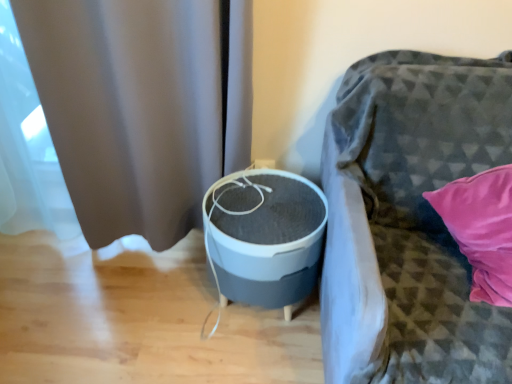
This screenshot has width=512, height=384. Describe the element at coordinates (410, 219) in the screenshot. I see `textured gray fabric couch at right` at that location.

Find the location of a particular element. The image size is (512, 384). gray matte/soft fabric round table at center is located at coordinates (265, 236).

Locate an element on the screen. This screenshot has width=512, height=384. textured gray fabric couch at right is located at coordinates (410, 219).

Considering the relative sizes of textured gray fabric couch at right and gray matte/soft fabric round table at center in the image provided, is textured gray fabric couch at right bigger than gray matte/soft fabric round table at center?

Yes, textured gray fabric couch at right is bigger than gray matte/soft fabric round table at center.

Looking at their sizes, would you say textured gray fabric couch at right is wider or thinner than gray matte/soft fabric round table at center?

textured gray fabric couch at right is wider than gray matte/soft fabric round table at center.

Looking at this image, would you say textured gray fabric couch at right is inside or outside gray matte/soft fabric round table at center?

textured gray fabric couch at right is not inside gray matte/soft fabric round table at center, it's outside.

The height and width of the screenshot is (384, 512). I want to click on round table behind the textured gray fabric couch at right, so click(265, 236).

Can you tell me how much textured gray fabric couch at right and gray matte curtain at left differ in facing direction?

The angular difference between textured gray fabric couch at right and gray matte curtain at left is 0.666 degrees.

From a real-world perspective, is textured gray fabric couch at right physically located above or below gray matte curtain at left?

Clearly, from a real-world perspective, textured gray fabric couch at right is below gray matte curtain at left.

How much distance is there between textured gray fabric couch at right and gray matte curtain at left?

textured gray fabric couch at right is 24.93 inches from gray matte curtain at left.

Which is in front, point (455, 65) or point (184, 148)?

The point (455, 65) is more forward.

Between gray matte curtain at left and gray matte/soft fabric round table at center, which one has more height?

gray matte curtain at left.

From the image's perspective, which is above, gray matte curtain at left or gray matte/soft fabric round table at center?

gray matte curtain at left appears higher in the image.

Which object is thinner, gray matte curtain at left or gray matte/soft fabric round table at center?

Thinner between the two is gray matte curtain at left.

Which is in front, gray matte curtain at left or gray matte/soft fabric round table at center?

gray matte curtain at left is in front.

From a real-world perspective, which object rests below the other?

In real-world perspective, gray matte/soft fabric round table at center is lower.

In the scene shown: Is gray matte/soft fabric round table at center facing away from gray matte curtain at left?

gray matte/soft fabric round table at center is not turned away from gray matte curtain at left.

Locate an element on the screen. curtain above the gray matte/soft fabric round table at center (from the image's perspective) is located at coordinates (141, 106).

From the image's perspective, which is below, gray matte/soft fabric round table at center or gray matte curtain at left?

gray matte/soft fabric round table at center appears lower in the image.

Does gray matte curtain at left appear on the left side of textured gray fabric couch at right?

Yes.

Based on the photo, which of these two, gray matte curtain at left or textured gray fabric couch at right, is smaller?

Smaller between the two is gray matte curtain at left.

From the image's perspective, which object appears higher, gray matte curtain at left or textured gray fabric couch at right?

From the image's view, gray matte curtain at left is above.

Does point (139, 156) come farther from viewer compared to point (498, 57)?

Yes.

Does gray matte/soft fabric round table at center turn towards textured gray fabric couch at right?

No, gray matte/soft fabric round table at center is not oriented towards textured gray fabric couch at right.

From their relative heights in the image, would you say gray matte/soft fabric round table at center is taller or shorter than textured gray fabric couch at right?

Clearly, gray matte/soft fabric round table at center is shorter compared to textured gray fabric couch at right.

Between gray matte/soft fabric round table at center and textured gray fabric couch at right, which one is positioned behind?

gray matte/soft fabric round table at center is further from the camera.

Would you say gray matte/soft fabric round table at center is outside textured gray fabric couch at right?

gray matte/soft fabric round table at center is positioned outside textured gray fabric couch at right.

The width and height of the screenshot is (512, 384). I want to click on round table behind the textured gray fabric couch at right, so click(x=265, y=236).

The width and height of the screenshot is (512, 384). Identify the location of furniture that appears below the gray matte curtain at left (from the image's perspective). (410, 219).

Looking at the image, which one is located closer to textured gray fabric couch at right, gray matte/soft fabric round table at center or gray matte curtain at left?

gray matte/soft fabric round table at center.

From the image, which object appears to be nearer to gray matte curtain at left, textured gray fabric couch at right or gray matte/soft fabric round table at center?

Among the two, gray matte/soft fabric round table at center is located nearer to gray matte curtain at left.

Which object lies nearer to the anchor point gray matte curtain at left, gray matte/soft fabric round table at center or textured gray fabric couch at right?

Based on the image, gray matte/soft fabric round table at center appears to be nearer to gray matte curtain at left.

Based on their spatial positions, is gray matte curtain at left or gray matte/soft fabric round table at center closer to textured gray fabric couch at right?

Among the two, gray matte/soft fabric round table at center is located nearer to textured gray fabric couch at right.

Based on their spatial positions, is textured gray fabric couch at right or gray matte curtain at left closer to gray matte/soft fabric round table at center?

textured gray fabric couch at right.

Based on the photo, estimate the real-world distances between objects in this image. Which object is closer to gray matte/soft fabric round table at center, gray matte curtain at left or textured gray fabric couch at right?

The object closer to gray matte/soft fabric round table at center is textured gray fabric couch at right.

Image resolution: width=512 pixels, height=384 pixels. Find the location of `round table situated between gray matte curtain at left and textured gray fabric couch at right from left to right`. round table situated between gray matte curtain at left and textured gray fabric couch at right from left to right is located at coordinates (265, 236).